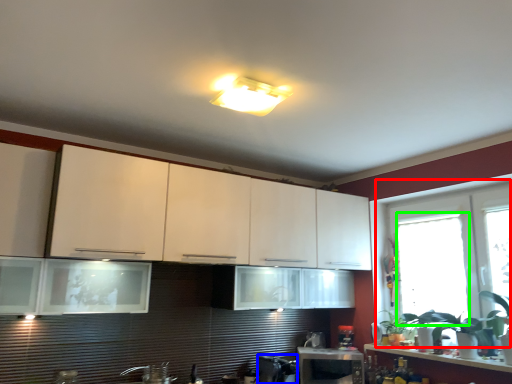
Question: Which object is the closest to the window (highlighted by a red box)? Choose among these: appliance (highlighted by a blue box) or window (highlighted by a green box).

Choices:
 (A) appliance
 (B) window

Answer: (B)